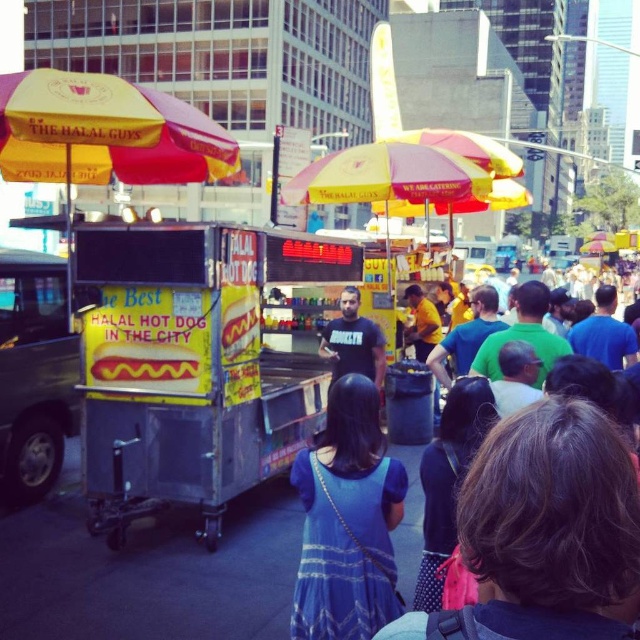
You are a customer waiting in line at the rusty metal hot dog cart at center and the blue fabric dress at lower center. Which object is located to the right of the other?

The blue fabric dress at lower center is located to the right of the rusty metal hot dog cart at center.

You are a photographer trying to capture a photo of the blue fabric dress at lower center and the yellow fabric umbrella at upper left. Which object should you focus on first if you want to include both in your frame without moving the camera?

The blue fabric dress at lower center should be focused on first because it is taller than the yellow fabric umbrella at upper left, allowing it to be more prominent in the frame.

You are a photographer trying to capture a photo of the yellow matte hot dog at center without including the blue fabric dress at lower center in the frame. Given their sizes, is this possible?

The blue fabric dress at lower center is narrower than the yellow matte hot dog at center. Therefore, it might be challenging to exclude the dress from the photo if they are positioned close together, but adjusting the camera angle or zoom could help isolate the hot dog.